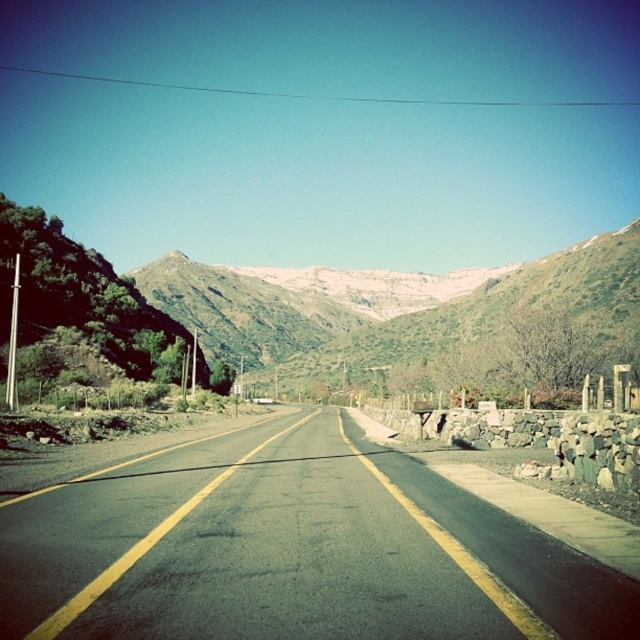
Question: Can you confirm if asphalt road at center is positioned to the left of green grassy mountain at center?

Choices:
 (A) no
 (B) yes

Answer: (B)

Question: Which object is closer to the camera taking this photo?

Choices:
 (A) green grassy mountain at center
 (B) smooth stone wall at right
 (C) asphalt road at center

Answer: (C)

Question: Which point appears farthest from the camera in this image?

Choices:
 (A) (460, 339)
 (B) (536, 512)

Answer: (A)

Question: Which point is closer to the camera?

Choices:
 (A) (595, 250)
 (B) (488, 476)
 (C) (547, 620)

Answer: (C)

Question: Does asphalt road at center appear under green grassy mountain at center?

Choices:
 (A) no
 (B) yes

Answer: (B)

Question: Does asphalt road at center appear over smooth stone wall at right?

Choices:
 (A) yes
 (B) no

Answer: (A)